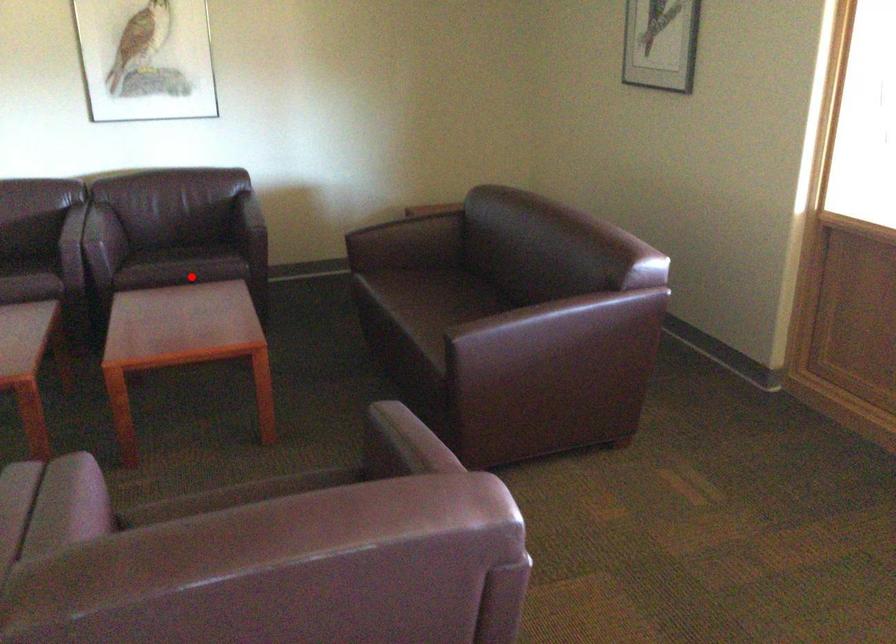
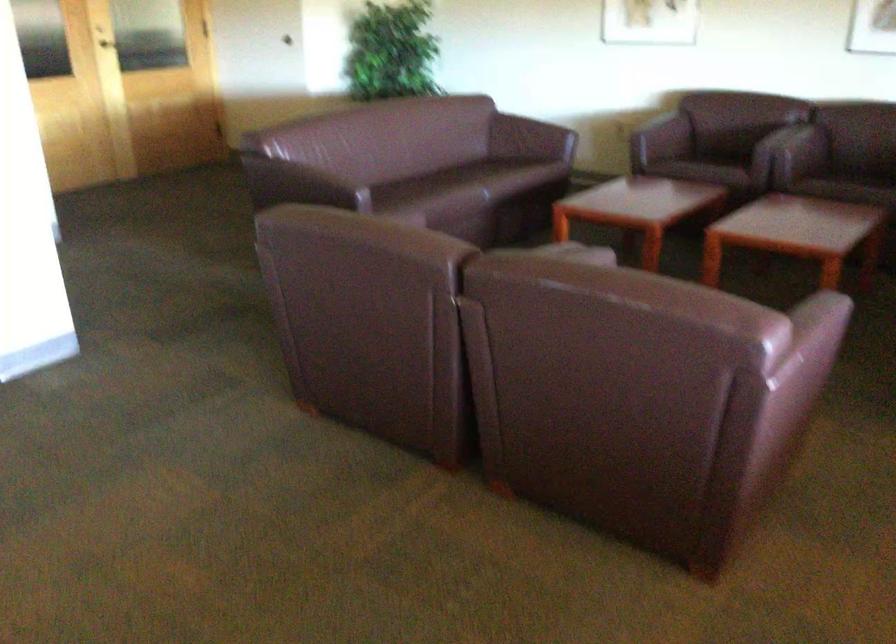
In the second image, find the point that corresponds to the highlighted location in the first image.

(853, 185)